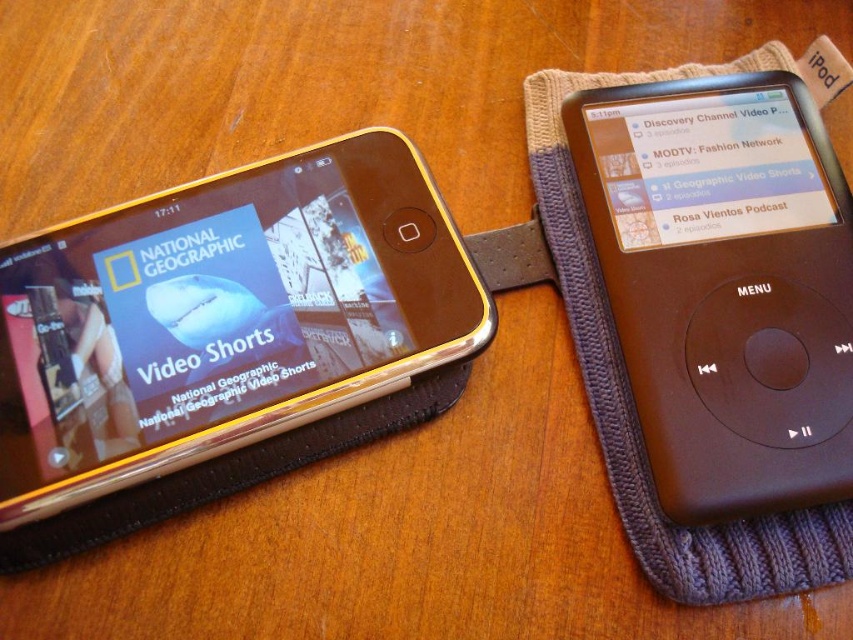
You are looking at the two electronic devices on the wooden surface. Which of the two points, point (412, 186) or point (653, 182), is closer to you?

Point (412, 186) is closer to the camera than point (653, 182), so point (412, 186) is closer to you.

You are setting up a display for an electronics store. You have a gold metallic smartphone at left and a black matte ipod at right. According to the image, which device is positioned lower on the wooden surface?

The gold metallic smartphone at left is positioned lower than the black matte ipod at right on the wooden surface.